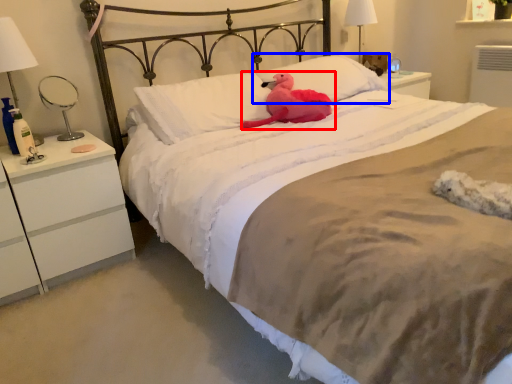
Question: Among these objects, which one is farthest to the camera, animal (highlighted by a red box) or pillow (highlighted by a blue box)?

Choices:
 (A) animal
 (B) pillow

Answer: (B)